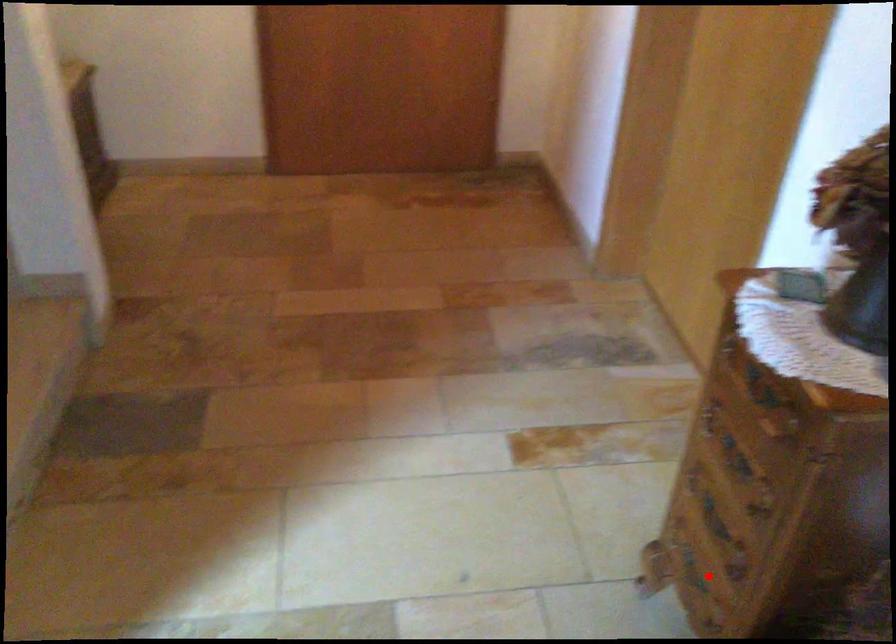
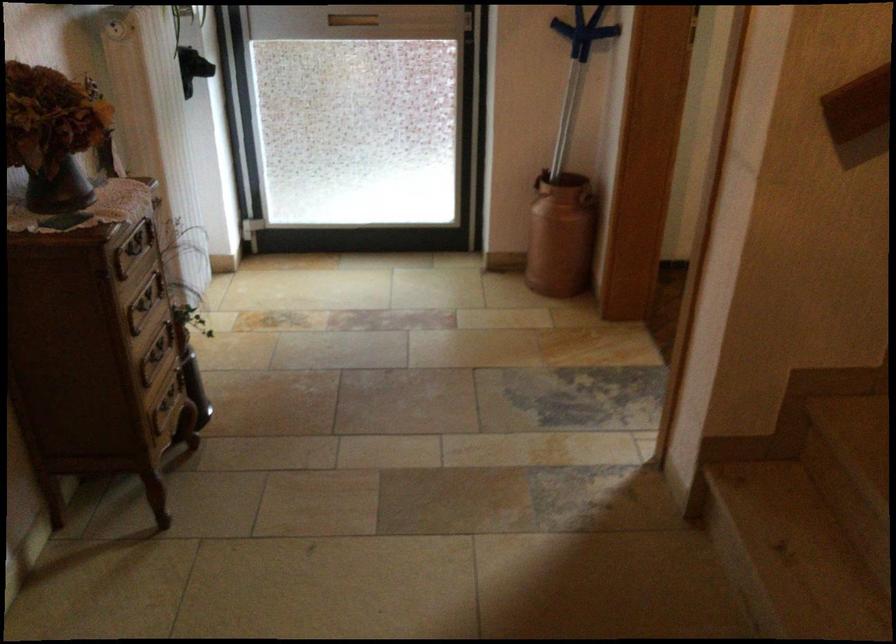
In the second image, find the point that corresponds to the highlighted location in the first image.

(167, 404)